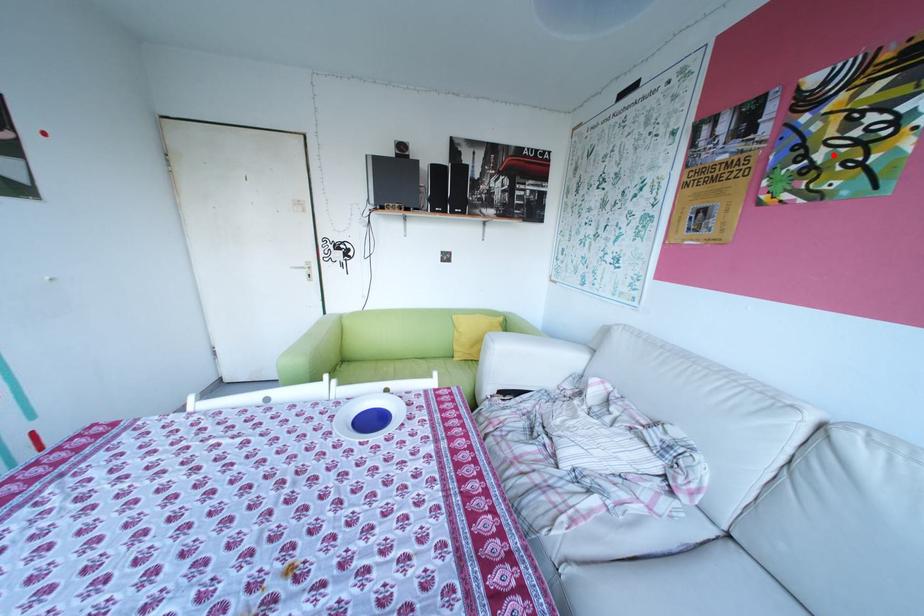
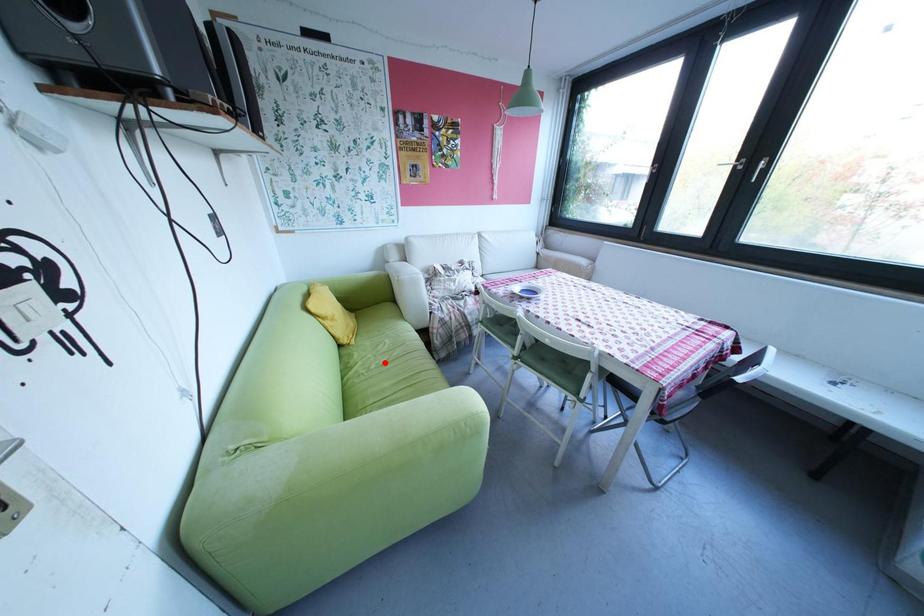
I am providing you with two images of the same scene from different viewpoints. A red point is marked on the first image and another point is marked on the second image. Do the highlighted points in image1 and image2 indicate the same real-world spot?

No